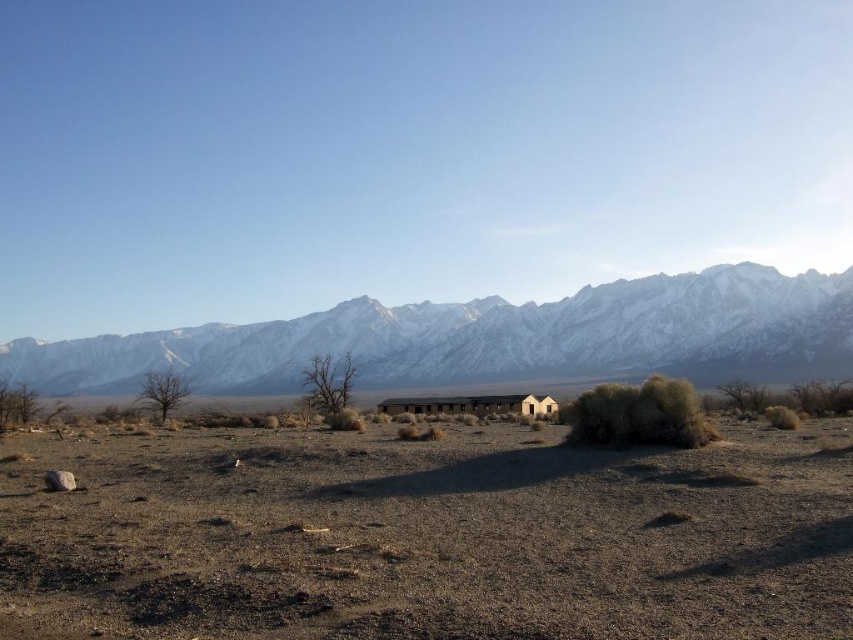
Can you confirm if brown/dry soil at center is positioned below snowy granite mountain range at upper center?

Indeed, brown/dry soil at center is positioned under snowy granite mountain range at upper center.

Who is taller, brown/dry soil at center or snowy granite mountain range at upper center?

Standing taller between the two is snowy granite mountain range at upper center.

The image size is (853, 640). Identify the location of brown/dry soil at center. (428, 536).